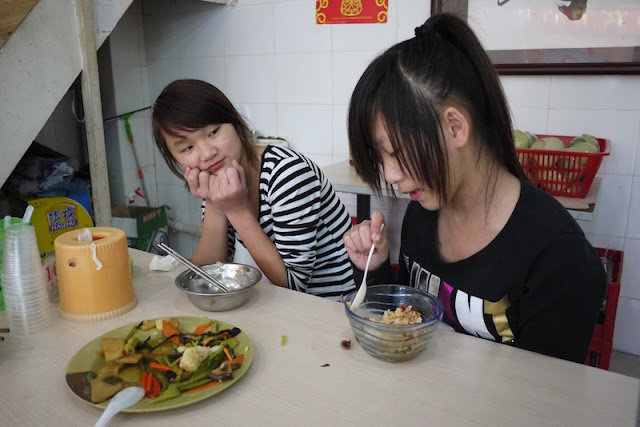
Where is `reflective glass`? This screenshot has height=427, width=640. reflective glass is located at coordinates (532, 19).